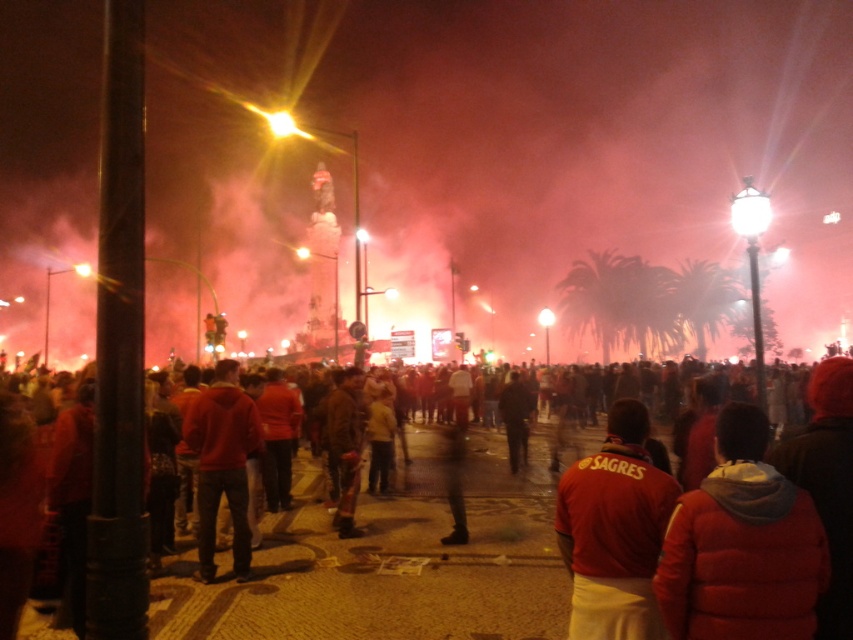
Question: Which point appears farthest from the camera in this image?

Choices:
 (A) (566, 600)
 (B) (219, 460)
 (C) (663, 532)

Answer: (B)

Question: Which object is the farthest from the red fabric jacket at center?

Choices:
 (A) red matte jacket at lower right
 (B) red puffer jacket at lower right

Answer: (A)

Question: Does red puffer jacket at lower right appear under red matte jacket at lower right?

Choices:
 (A) no
 (B) yes

Answer: (A)

Question: Does red fabric jacket at center have a lesser width compared to matte red hoodie at center?

Choices:
 (A) no
 (B) yes

Answer: (A)

Question: Which point is farther to the camera?

Choices:
 (A) (364, 493)
 (B) (567, 572)
 (C) (213, 436)

Answer: (A)

Question: Does red fabric jacket at center appear over matte red hoodie at center?

Choices:
 (A) yes
 (B) no

Answer: (B)